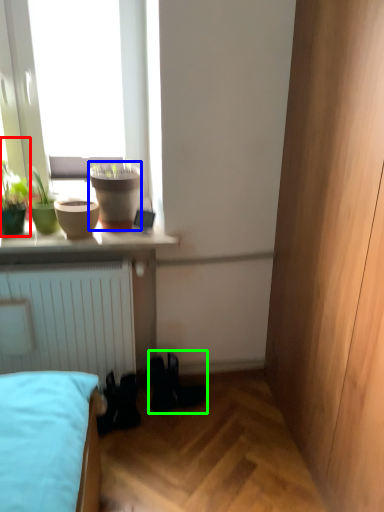
Question: Which object is the farthest from houseplant (highlighted by a red box)? Choose among these: flowerpot (highlighted by a blue box) or shoe (highlighted by a green box).

Choices:
 (A) flowerpot
 (B) shoe

Answer: (B)